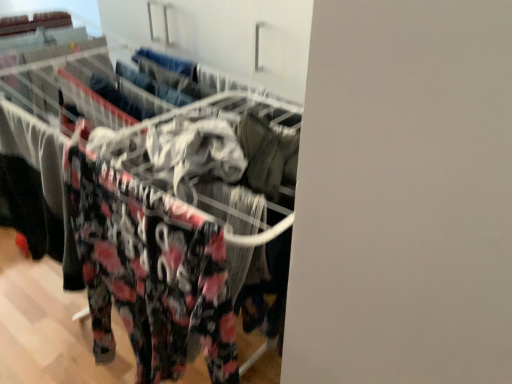
This screenshot has width=512, height=384. What do you see at coordinates (50, 114) in the screenshot?
I see `fluffy fabric pants at center` at bounding box center [50, 114].

Where is `fluffy fabric pants at center`? The width and height of the screenshot is (512, 384). fluffy fabric pants at center is located at coordinates (50, 114).

I want to click on fluffy fabric pants at center, so click(50, 114).